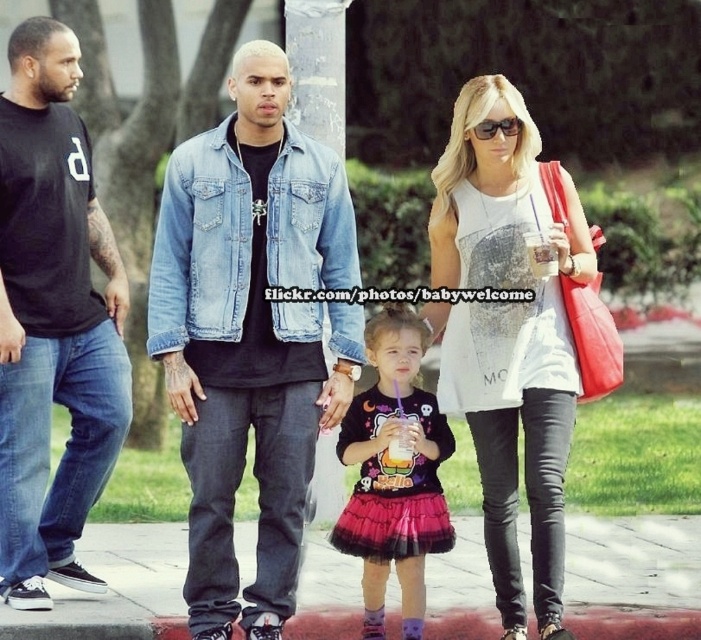
Find the location of a particular element. This screenshot has width=701, height=640. black t-shirt at left is located at coordinates (53, 321).

At what (x,y) coordinates should I click in order to perform the action: click on black t-shirt at left. Please return your answer as a coordinate pair (x, y). This screenshot has width=701, height=640. Looking at the image, I should click on (53, 321).

Does faded denim jacket at center appear on the left side of sunglasses at center?

Yes, faded denim jacket at center is to the left of sunglasses at center.

Can you confirm if faded denim jacket at center is wider than sunglasses at center?

Correct, the width of faded denim jacket at center exceeds that of sunglasses at center.

Who is more forward, [243,132] or [503,120]?

Point [503,120] is in front.

Locate an element on the screen. The width and height of the screenshot is (701, 640). faded denim jacket at center is located at coordinates (251, 333).

Is faded denim jacket at center thinner than black t-shirt at left?

No.

Who is positioned more to the left, faded denim jacket at center or black t-shirt at left?

Positioned to the left is black t-shirt at left.

Is point (250, 131) behind point (40, 72)?

No, (250, 131) is closer to viewer.

Find the location of `faded denim jacket at center`. faded denim jacket at center is located at coordinates pyautogui.click(x=251, y=333).